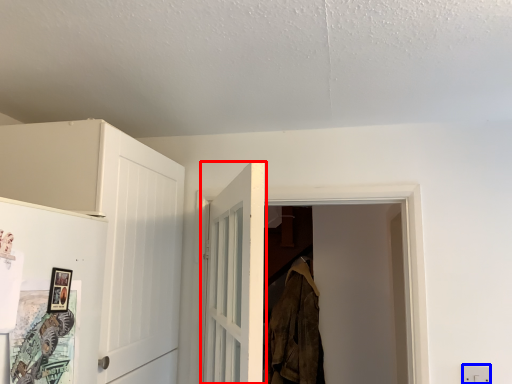
Question: Which object appears closest to the camera in this image, door (highlighted by a red box) or electric outlet (highlighted by a blue box)?

Choices:
 (A) door
 (B) electric outlet

Answer: (A)